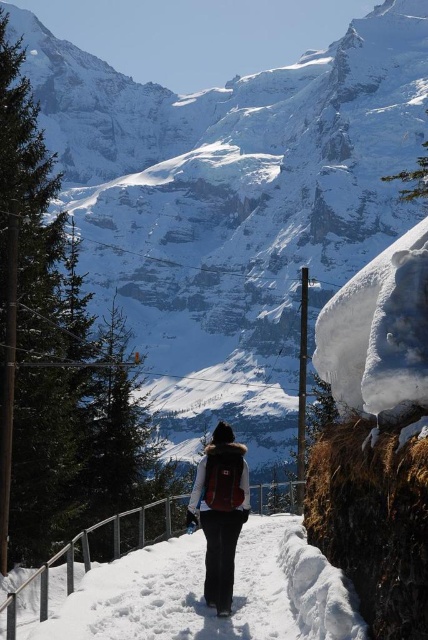
You are an observer standing on the snowy path. You notice the black fabric pants at center and the matte brown backpack at center. Which object is shorter in height?

The black fabric pants at center has a lesser height compared to the matte brown backpack at center, so the black fabric pants at center is shorter in height.

You are a photographer trying to capture the person in the winter scene. You want to ensure both the black fabric pants at center and the matte brown backpack at center are clearly visible in your shot. Based on their positions, which object should you focus on first to ensure both are in focus?

The black fabric pants at center is located below the matte brown backpack at center. To ensure both are in focus, you should focus on the matte brown backpack at center first since it is higher up and closer to the background, allowing the pants to fall within the depth of field.

You are standing at the point marked as point [202,593] in the image. What object is located exactly at this point?

The point [202,593] corresponds to the black fabric pants at center.